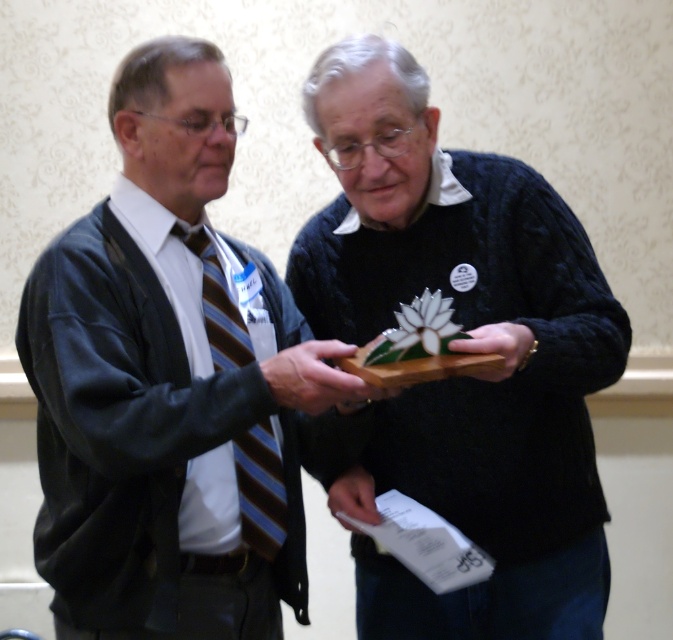
Who is positioned more to the right, cable-knit sweater at center or gold metallic watch at center?

gold metallic watch at center is more to the right.

Can you confirm if cable-knit sweater at center is positioned to the right of gold metallic watch at center?

No, cable-knit sweater at center is not to the right of gold metallic watch at center.

Locate an element on the screen. This screenshot has width=673, height=640. cable-knit sweater at center is located at coordinates (464, 330).

Is matte black jacket at left positioned in front of brown striped tie at left?

Yes, it is.

Is matte black jacket at left thinner than brown striped tie at left?

Incorrect, matte black jacket at left's width is not less than brown striped tie at left's.

This screenshot has height=640, width=673. What are the coordinates of `matte black jacket at left` in the screenshot? It's located at (168, 387).

Locate an element on the screen. The image size is (673, 640). matte black jacket at left is located at coordinates (168, 387).

Is brown striped tie at left below white paper at center?

No, brown striped tie at left is not below white paper at center.

Can you confirm if brown striped tie at left is bigger than white paper at center?

Indeed, brown striped tie at left has a larger size compared to white paper at center.

This screenshot has height=640, width=673. Describe the element at coordinates (260, 490) in the screenshot. I see `brown striped tie at left` at that location.

Where is `brown striped tie at left`? brown striped tie at left is located at coordinates (260, 490).